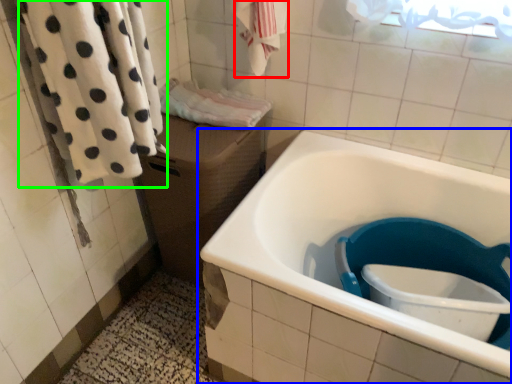
Question: Which object is positioned farthest from bath towel (highlighted by a red box)? Select from bathtub (highlighted by a blue box) and bath towel (highlighted by a green box).

Choices:
 (A) bathtub
 (B) bath towel

Answer: (A)